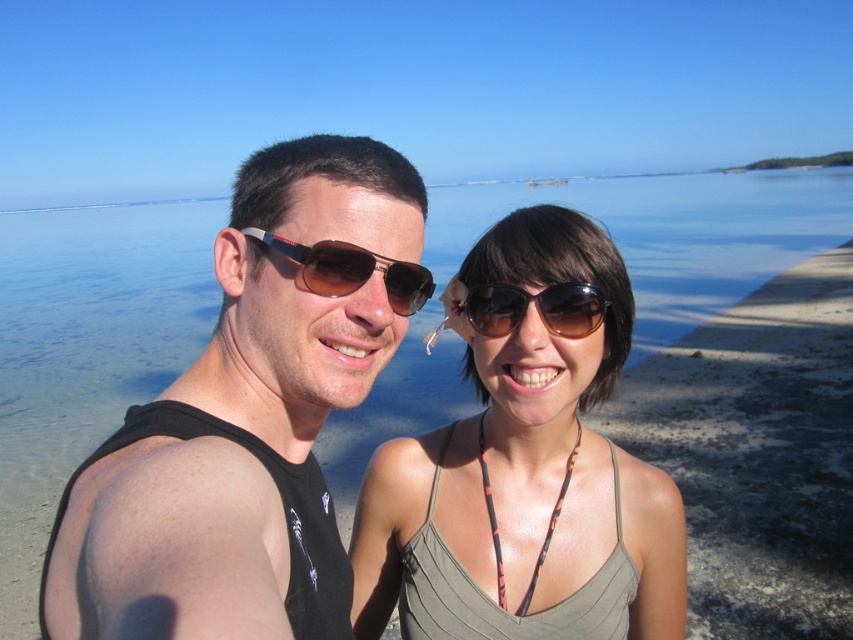
Question: Does black matte tank top at center have a lesser width compared to matte gray tank top at center?

Choices:
 (A) yes
 (B) no

Answer: (A)

Question: Is black matte tank top at center positioned at the back of matte gray tank top at center?

Choices:
 (A) no
 (B) yes

Answer: (A)

Question: Which of the following is the farthest from the observer?

Choices:
 (A) (517, 324)
 (B) (154, 560)
 (C) (671, 576)

Answer: (C)

Question: Which point appears farthest from the camera in this image?

Choices:
 (A) (605, 534)
 (B) (595, 301)
 (C) (412, 285)
 (D) (305, 529)

Answer: (A)

Question: Is matte gray tank top at center to the left of brown reflective sunglasses at center from the viewer's perspective?

Choices:
 (A) no
 (B) yes

Answer: (A)

Question: Which object is closer to the camera taking this photo?

Choices:
 (A) matte gray tank top at center
 (B) sunglasses at center

Answer: (B)